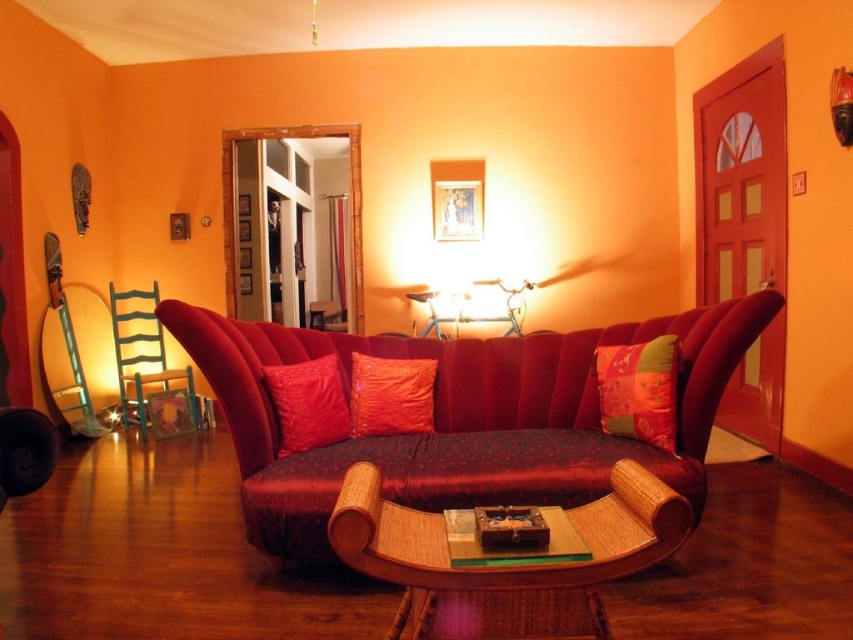
Who is shorter, woven bamboo coffee table at center or shiny red pillow at center?

With less height is shiny red pillow at center.

Does woven bamboo coffee table at center lie in front of shiny red pillow at center?

Yes, woven bamboo coffee table at center is in front of shiny red pillow at center.

Is point (398, 572) positioned before point (386, 426)?

Yes, point (398, 572) is in front of point (386, 426).

Where is `woven bamboo coffee table at center`? woven bamboo coffee table at center is located at coordinates (506, 564).

Is point (602, 381) less distant than point (120, 307)?

Yes, it is in front of point (120, 307).

Between silky red pillow at center and green painted wood armchair at left, which one appears on the left side from the viewer's perspective?

green painted wood armchair at left

Which is behind, point (614, 400) or point (120, 301)?

Positioned behind is point (120, 301).

Find the location of `silky red pillow at center`. silky red pillow at center is located at coordinates (639, 390).

Between shiny red pillow at center and velvet cushion at center, which one appears on the right side from the viewer's perspective?

shiny red pillow at center

Which is behind, point (383, 381) or point (314, 440)?

The point (383, 381) is more distant.

Where is `shiny red pillow at center`? Image resolution: width=853 pixels, height=640 pixels. shiny red pillow at center is located at coordinates (392, 396).